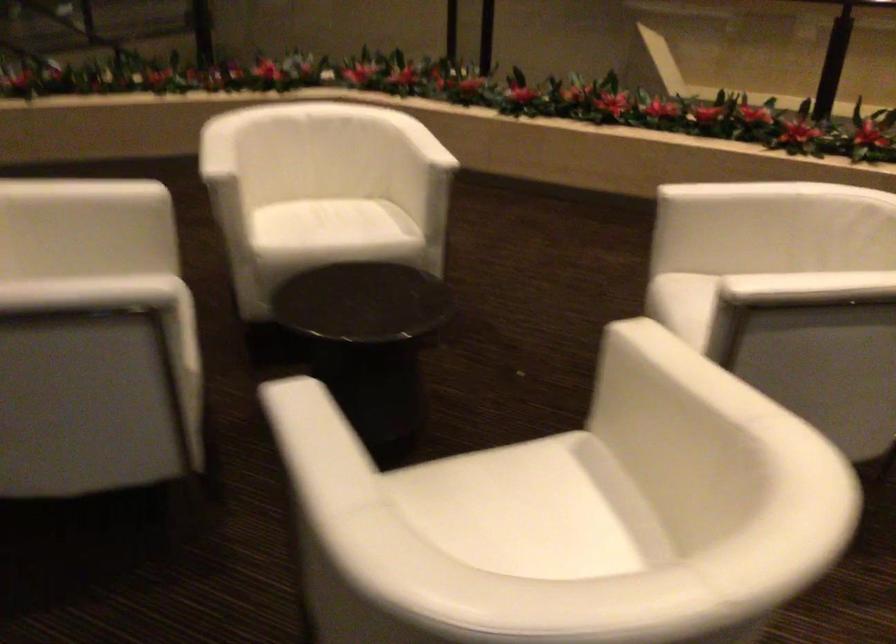
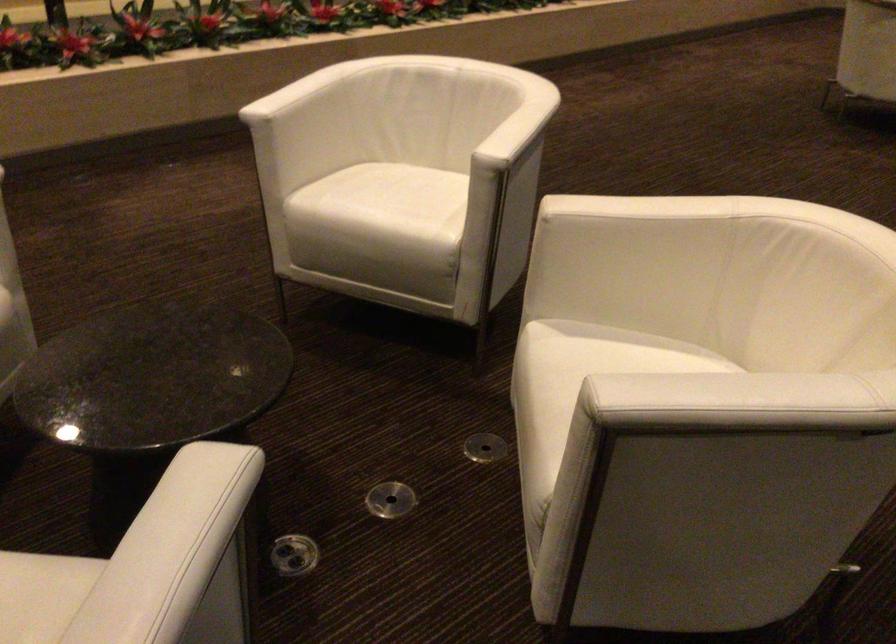
Find the pixel in the second image that matches the point at 350,301 in the first image.

(152, 377)